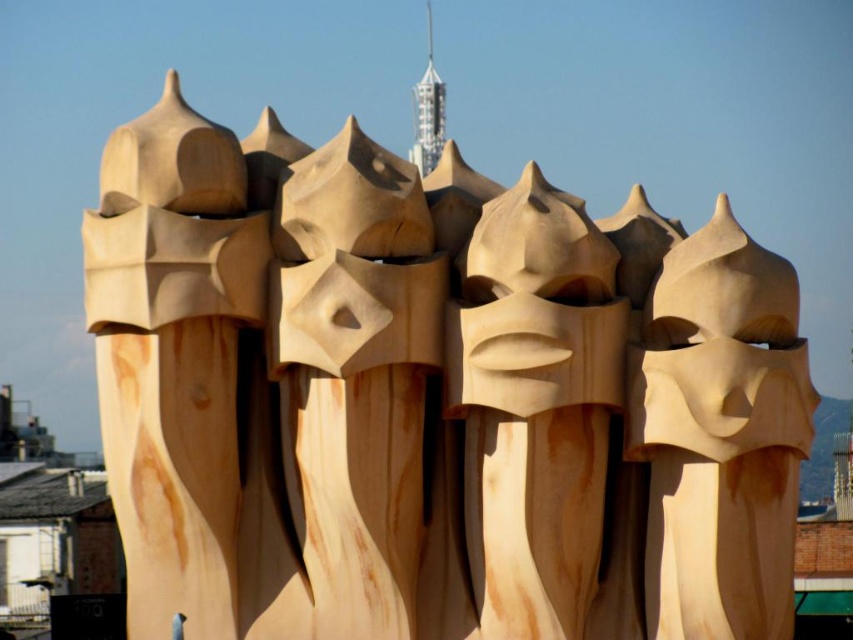
Can you confirm if natural wood sculpture at upper left is positioned below natural wood sculpture at center?

Yes, natural wood sculpture at upper left is below natural wood sculpture at center.

Is natural wood sculpture at upper left further to camera compared to natural wood sculpture at center?

Yes, it is.

I want to click on natural wood sculpture at upper left, so click(173, 356).

Who is taller, natural wood sculpture at upper left or natural wood mask at center?

natural wood sculpture at upper left is taller.

In the scene shown: Is natural wood sculpture at upper left to the right of natural wood mask at center from the viewer's perspective?

In fact, natural wood sculpture at upper left is to the left of natural wood mask at center.

Between point (184, 499) and point (490, 397), which one is positioned in front?

Point (490, 397)

The image size is (853, 640). In order to click on natural wood sculpture at upper left in this screenshot , I will do `click(173, 356)`.

Is point (466, 493) positioned in front of point (697, 582)?

That is False.

Is natural wood mask at center to the right of natural wood sculpture at center from the viewer's perspective?

Incorrect, natural wood mask at center is not on the right side of natural wood sculpture at center.

I want to click on natural wood mask at center, so click(534, 404).